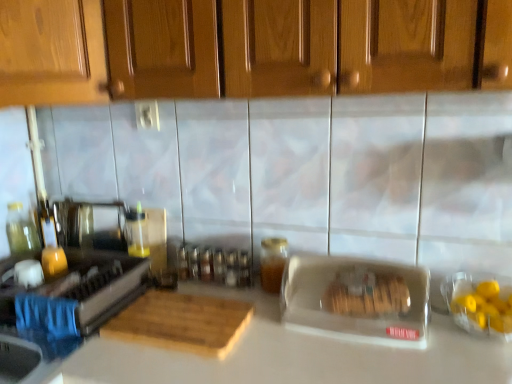
Question: Does wooden cabinet at upper center have a lesser height compared to white matte countertop at center?

Choices:
 (A) yes
 (B) no

Answer: (A)

Question: Does wooden cabinet at upper center have a lesser width compared to white matte countertop at center?

Choices:
 (A) yes
 (B) no

Answer: (A)

Question: Does wooden cabinet at upper center come in front of white matte countertop at center?

Choices:
 (A) no
 (B) yes

Answer: (B)

Question: From the image's perspective, would you say wooden cabinet at upper center is shown under white matte countertop at center?

Choices:
 (A) yes
 (B) no

Answer: (B)

Question: Is wooden cabinet at upper center to the left of white matte countertop at center from the viewer's perspective?

Choices:
 (A) no
 (B) yes

Answer: (B)

Question: From a real-world perspective, relative to white matte countertop at center, is wooden cabinet at upper center vertically above or below?

Choices:
 (A) above
 (B) below

Answer: (A)

Question: Is point (303, 18) closer or farther from the camera than point (238, 374)?

Choices:
 (A) closer
 (B) farther

Answer: (A)

Question: From their relative heights in the image, would you say wooden cabinet at upper center is taller or shorter than white matte countertop at center?

Choices:
 (A) short
 (B) tall

Answer: (A)

Question: Considering their positions, is wooden cabinet at upper center located in front of or behind white matte countertop at center?

Choices:
 (A) front
 (B) behind

Answer: (A)

Question: Considering the positions of stainless steel stove at left, arranged as the 2th appliance when viewed from the right, and clear plastic container at center, the 2th appliance positioned from the left, in the image, is stainless steel stove at left, arranged as the 2th appliance when viewed from the right, wider or thinner than clear plastic container at center, the 2th appliance positioned from the left,?

Choices:
 (A) wide
 (B) thin

Answer: (A)

Question: Considering their positions, is stainless steel stove at left, arranged as the 2th appliance when viewed from the right, located in front of or behind clear plastic container at center, the 2th appliance positioned from the left?

Choices:
 (A) behind
 (B) front

Answer: (A)

Question: Looking at the image, does stainless steel stove at left, arranged as the 2th appliance when viewed from the right, seem bigger or smaller compared to clear plastic container at center, the 2th appliance positioned from the left?

Choices:
 (A) big
 (B) small

Answer: (A)

Question: From a real-world perspective, is stainless steel stove at left, arranged as the 2th appliance when viewed from the right, physically located above or below clear plastic container at center, the 2th appliance positioned from the left?

Choices:
 (A) above
 (B) below

Answer: (B)

Question: Is stainless steel stove at left, the 1th appliance from the left, wider or thinner than wooden cutting board at center?

Choices:
 (A) thin
 (B) wide

Answer: (B)

Question: In the image, is stainless steel stove at left, the 1th appliance from the left, positioned in front of or behind wooden cutting board at center?

Choices:
 (A) front
 (B) behind

Answer: (A)